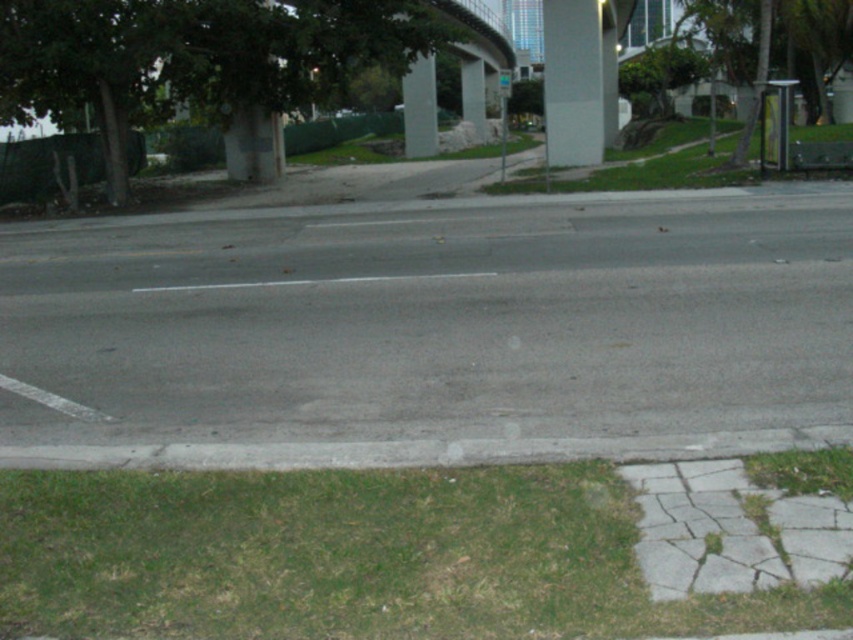
Which of these two, green grass at upper right or concrete pillar at center, stands shorter?

With less height is green grass at upper right.

Does green grass at upper right appear on the right side of concrete pillar at center?

Indeed, green grass at upper right is positioned on the right side of concrete pillar at center.

Is point (537, 188) less distant than point (479, 131)?

Yes.

Identify the location of green grass at upper right. (662, 172).

Describe the element at coordinates (433, 320) in the screenshot. I see `gray asphalt pavement at center` at that location.

Can you confirm if gray asphalt pavement at center is shorter than green grass at lower left?

No, gray asphalt pavement at center is not shorter than green grass at lower left.

Is point (364, 337) farther from viewer compared to point (695, 625)?

That is True.

Find the location of a particular element. The image size is (853, 640). gray asphalt pavement at center is located at coordinates (433, 320).

Locate an element on the screen. gray asphalt pavement at center is located at coordinates (x=433, y=320).

Does point (114, 324) come in front of point (648, 179)?

Yes, point (114, 324) is closer to viewer.

Does point (73, 336) come farther from viewer compared to point (660, 173)?

No.

Find the location of `gray asphalt pavement at center`. gray asphalt pavement at center is located at coordinates (433, 320).